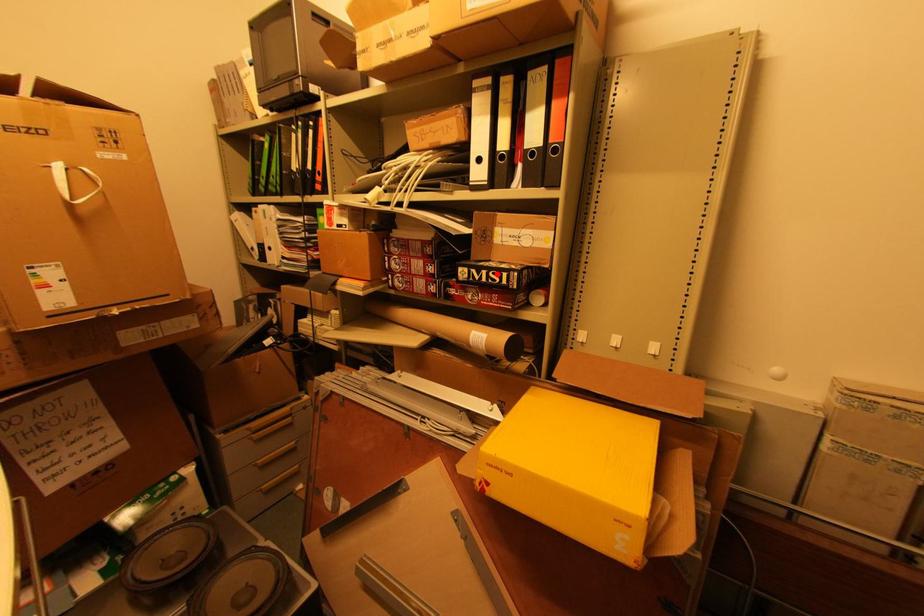
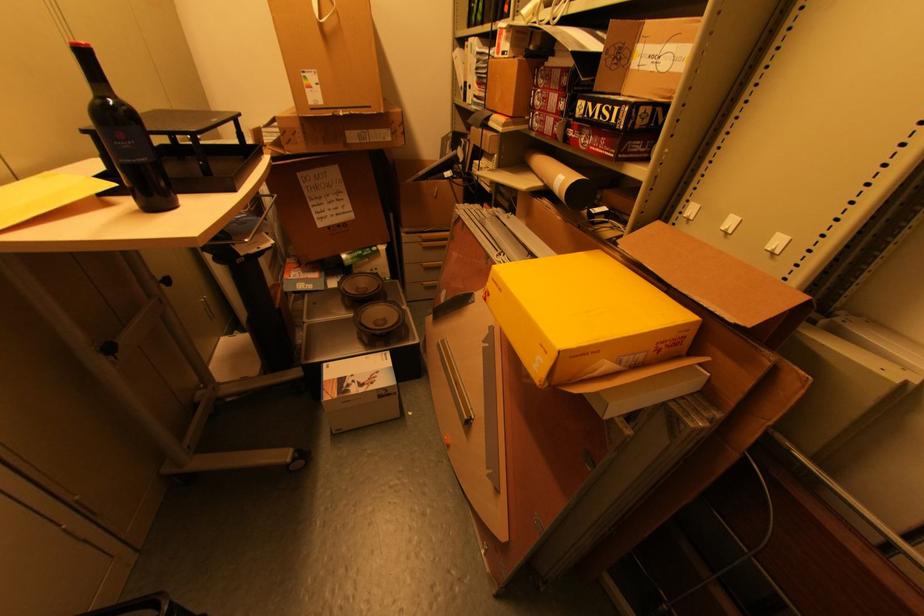
Question: I am providing you with two images of the same scene from different viewpoints. A red point is marked on the first image. Can you still see the location of the red point in image 2?

Choices:
 (A) Yes
 (B) No

Answer: (A)